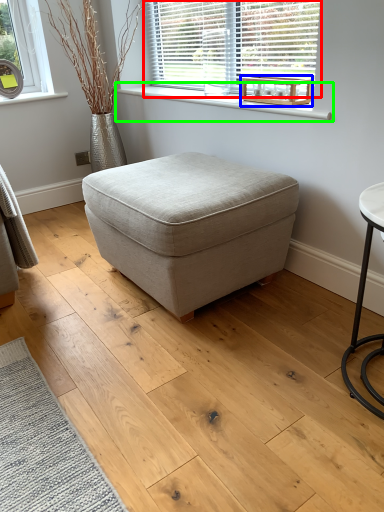
Question: Which is nearer to the window (highlighted by a red box)? round table (highlighted by a blue box) or window sill (highlighted by a green box).

Choices:
 (A) round table
 (B) window sill

Answer: (B)